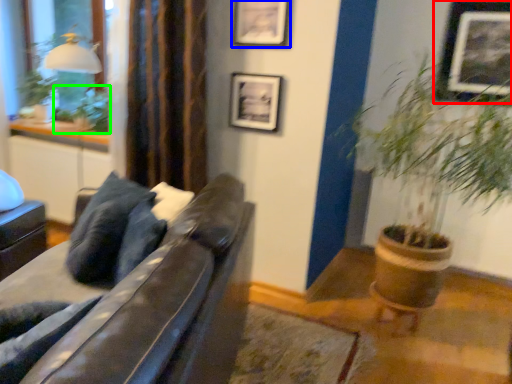
Question: Which is nearer to the picture frame (highlighted by a red box)? picture frame (highlighted by a blue box) or plant (highlighted by a green box).

Choices:
 (A) picture frame
 (B) plant

Answer: (A)